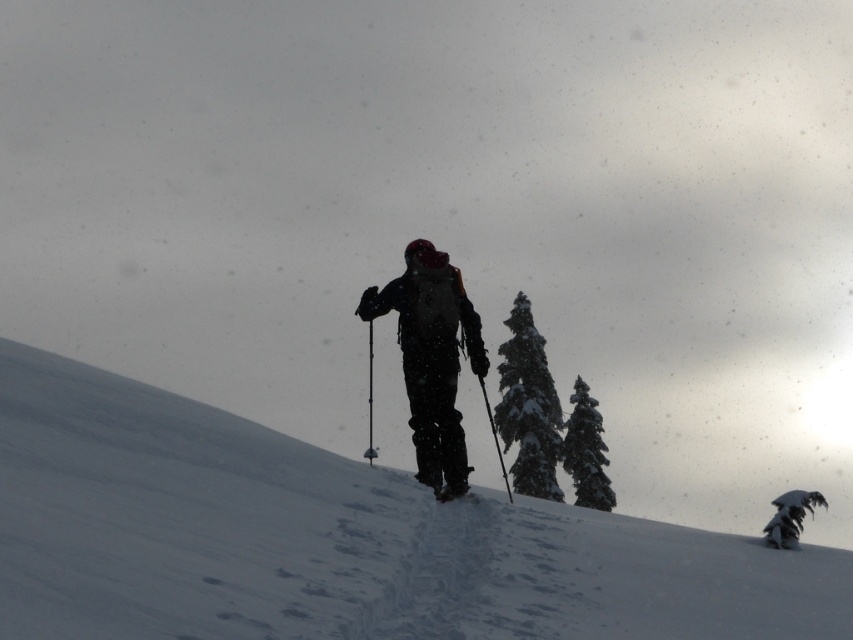
You are a hiker who has just started descending a snowy slope. You see the white fluffy snow at center and the green textured pine tree at upper right. Which object is farther from your current position?

The green textured pine tree at upper right is farther from your current position because the distance between the white fluffy snow at center and the green textured pine tree at upper right is 175.85 feet, so the pine tree is farther away than the snow at center.